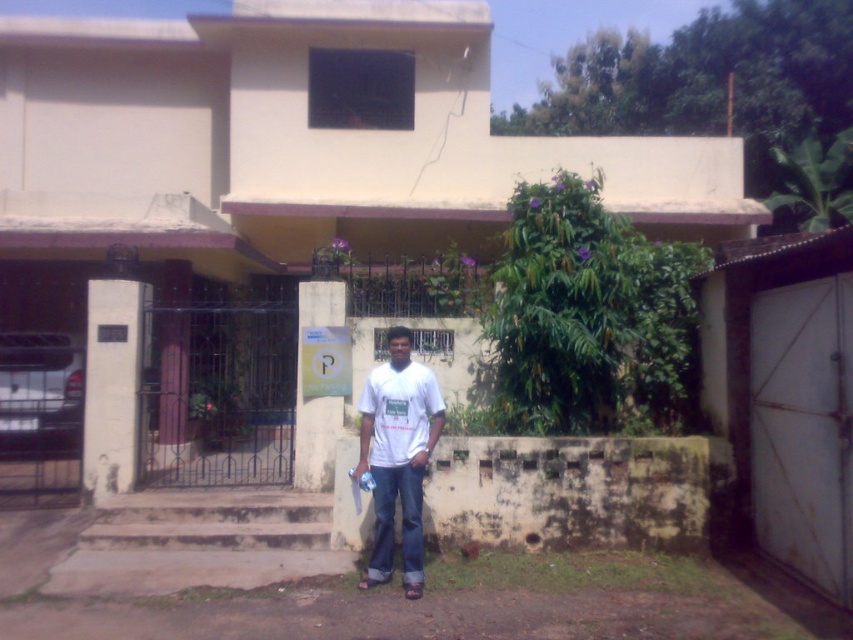
Question: Which point is closer to the camera?

Choices:
 (A) (140, 556)
 (B) (405, 417)

Answer: (B)

Question: Which object is farther from the camera taking this photo?

Choices:
 (A) white matte shirt at center
 (B) concrete stairs at center

Answer: (B)

Question: Is white matte shirt at center closer to the viewer compared to white matte t-shirt at center?

Choices:
 (A) no
 (B) yes

Answer: (B)

Question: Can you confirm if white matte shirt at center is smaller than white matte t-shirt at center?

Choices:
 (A) yes
 (B) no

Answer: (B)

Question: Is white matte shirt at center closer to the viewer compared to white matte t-shirt at center?

Choices:
 (A) no
 (B) yes

Answer: (B)

Question: Estimate the real-world distances between objects in this image. Which object is closer to the white matte t-shirt at center?

Choices:
 (A) concrete stairs at center
 (B) white matte shirt at center

Answer: (B)